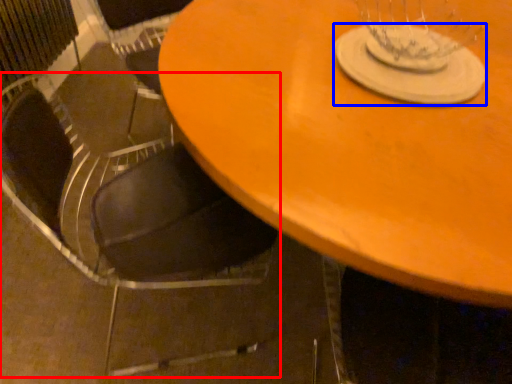
Question: Which object appears farthest to the camera in this image, chair (highlighted by a red box) or glass plate (highlighted by a blue box)?

Choices:
 (A) chair
 (B) glass plate

Answer: (B)